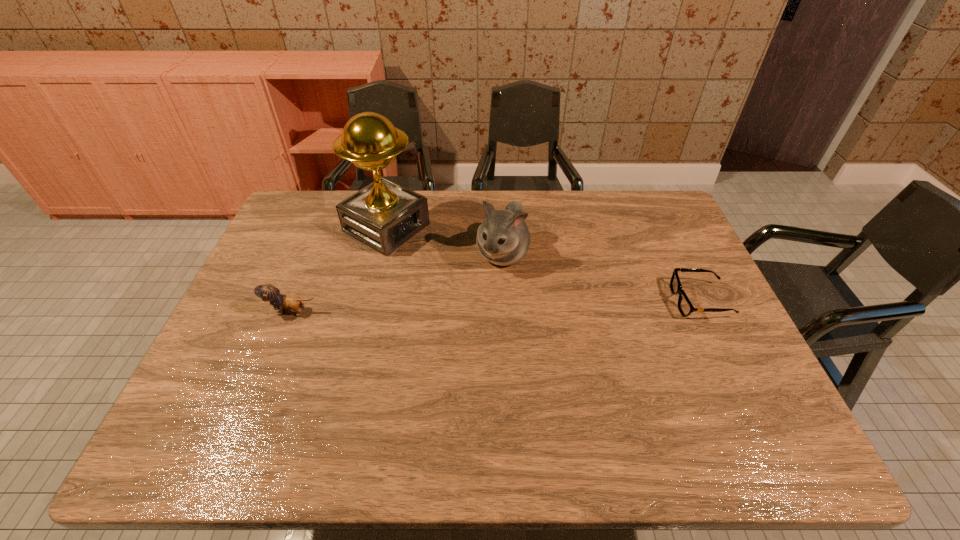
Identify the location of blank area at the near edge. (377, 409).

You are a GUI agent. You are given a task and a screenshot of the screen. Output one action in this format:
    pyautogui.click(x=<x>, y=<y>)
    Task: Click on the vacant space at the left edge of the desktop
    This screenshot has height=540, width=960.
    Given the screenshot: What is the action you would take?
    pyautogui.click(x=293, y=296)

The width and height of the screenshot is (960, 540). Identify the location of free location at the right edge of the desktop. (742, 343).

This screenshot has width=960, height=540. I want to click on blank space at the near left corner of the desktop, so click(223, 407).

Locate an element on the screen. The height and width of the screenshot is (540, 960). free space at the far right corner of the desktop is located at coordinates (677, 230).

Locate an element on the screen. The height and width of the screenshot is (540, 960). vacant area that lies between the rightmost object and the kitten is located at coordinates (496, 306).

This screenshot has height=540, width=960. I want to click on free space between the rightmost object and the second object from right to left, so click(x=601, y=278).

The height and width of the screenshot is (540, 960). I want to click on blank region between the second object from right to left and the shortest object, so click(x=601, y=278).

Locate an element on the screen. free point between the hamster and the tallest object is located at coordinates (444, 241).

You are a GUI agent. You are given a task and a screenshot of the screen. Output one action in this format:
    pyautogui.click(x=<x>, y=<y>)
    Task: Click on the vacant point located between the second shortest object and the hamster
    This screenshot has width=960, height=540.
    Given the screenshot: What is the action you would take?
    pyautogui.click(x=397, y=283)